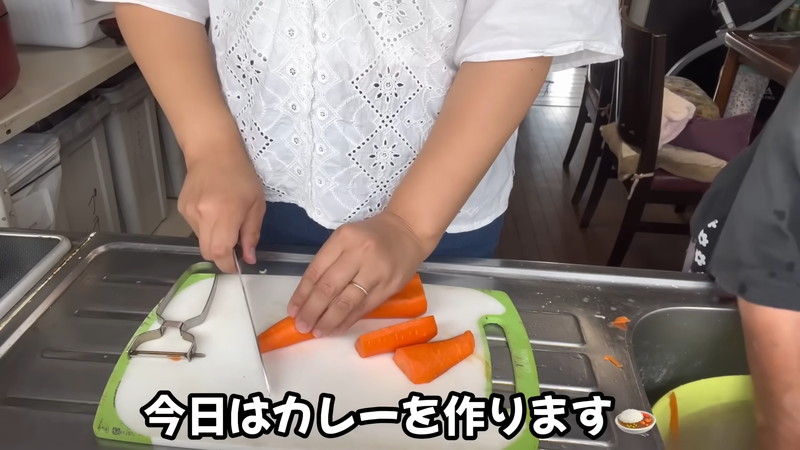
This screenshot has height=450, width=800. What are the coordinates of `sink basin` in the screenshot? It's located at (694, 347).